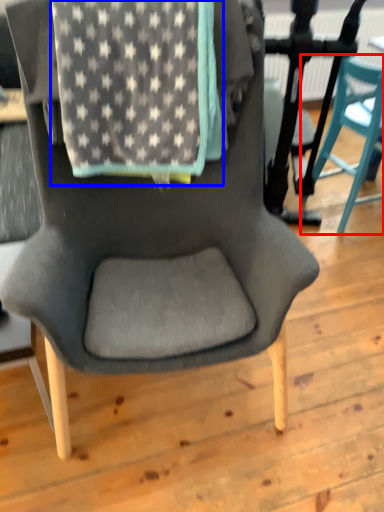
Question: Among these objects, which one is farthest to the camera, chair (highlighted by a red box) or blanket (highlighted by a blue box)?

Choices:
 (A) chair
 (B) blanket

Answer: (A)